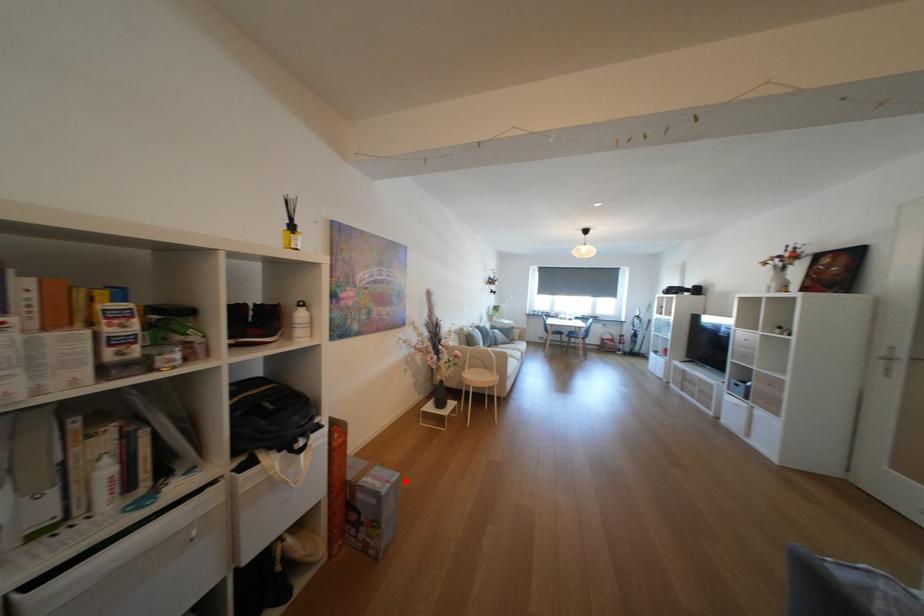
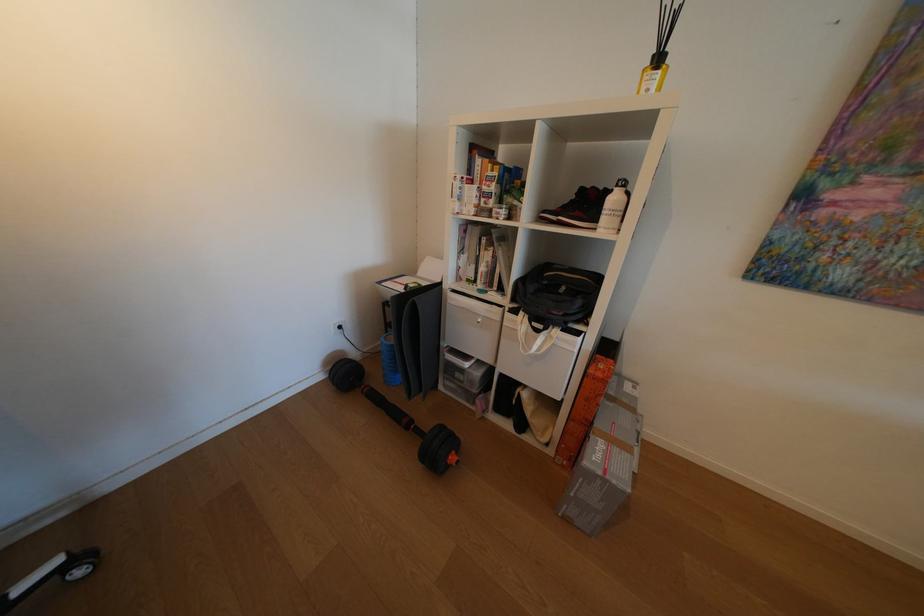
In the second image, find the point that corresponds to the highlighted location in the first image.

(626, 483)